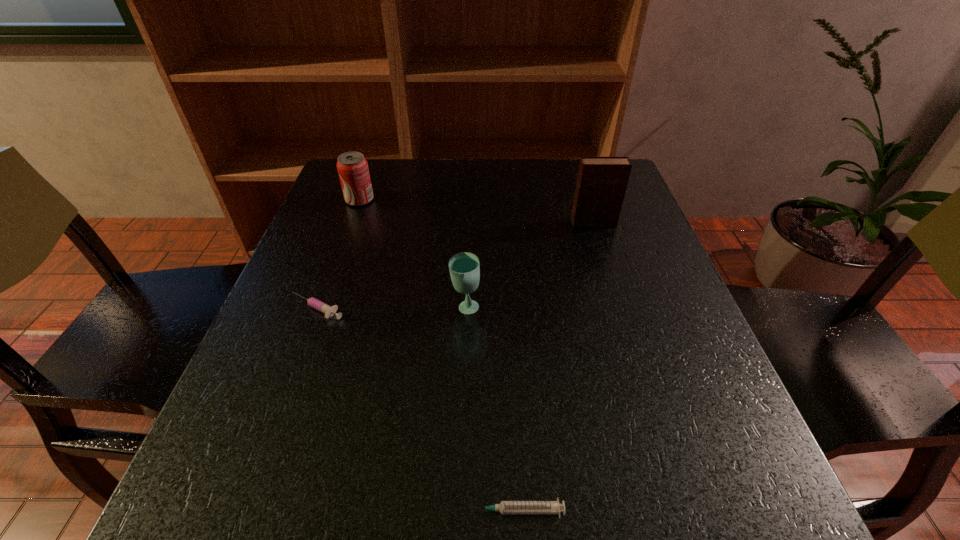
You are a GUI agent. You are given a task and a screenshot of the screen. Output one action in this format:
    pyautogui.click(x=<x>, y=<y>)
    Task: Click on the free space located on the right of the farther syringe
    This screenshot has width=960, height=540.
    Given the screenshot: What is the action you would take?
    pyautogui.click(x=387, y=308)

In order to click on vacant region located 0.180m at the needle end of the nearest object in this screenshot , I will do `click(335, 510)`.

The width and height of the screenshot is (960, 540). What are the coordinates of `free space located at the needle end of the nearest object` in the screenshot? It's located at (253, 510).

Locate an element on the screen. vacant space located 0.060m at the needle end of the nearest object is located at coordinates (424, 510).

Identify the location of object present at the far edge. (352, 167).

The width and height of the screenshot is (960, 540). I want to click on object that is at the near edge, so click(505, 507).

Where is `soda can that is at the left edge`? The width and height of the screenshot is (960, 540). soda can that is at the left edge is located at coordinates (352, 167).

Find the location of a particular element. This screenshot has height=540, width=960. syringe located at the left edge is located at coordinates (328, 310).

Find the location of `object situated at the right edge`. object situated at the right edge is located at coordinates (601, 184).

At what (x,y) coordinates should I click in order to perform the action: click on object present at the far left corner. Please return your answer as a coordinate pair (x, y). This screenshot has height=540, width=960. Looking at the image, I should click on click(352, 167).